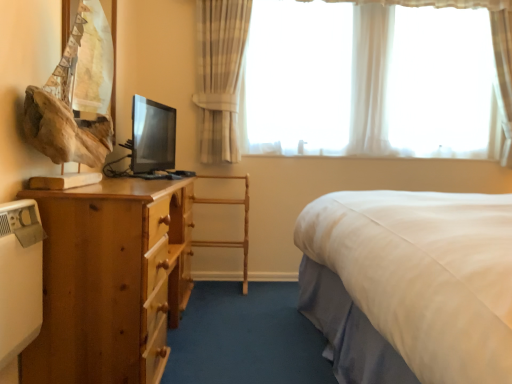
Question: Is the depth of white sheer curtains at upper center greater than that of wooden chair at center?

Choices:
 (A) yes
 (B) no

Answer: (A)

Question: Considering the relative positions of white sheer curtains at upper center and wooden chair at center in the image provided, is white sheer curtains at upper center in front of wooden chair at center?

Choices:
 (A) no
 (B) yes

Answer: (A)

Question: Is white sheer curtains at upper center wider than wooden chair at center?

Choices:
 (A) no
 (B) yes

Answer: (A)

Question: Is white sheer curtains at upper center next to wooden chair at center and touching it?

Choices:
 (A) yes
 (B) no

Answer: (B)

Question: Could you tell me if white sheer curtains at upper center is turned towards wooden chair at center?

Choices:
 (A) no
 (B) yes

Answer: (A)

Question: Considering the positions of point (x=166, y=281) and point (x=194, y=198), is point (x=166, y=281) closer or farther from the camera than point (x=194, y=198)?

Choices:
 (A) farther
 (B) closer

Answer: (B)

Question: Considering the positions of wooden drawer at lower left and wooden chair at center in the image, is wooden drawer at lower left bigger or smaller than wooden chair at center?

Choices:
 (A) big
 (B) small

Answer: (B)

Question: Is wooden drawer at lower left wider or thinner than wooden chair at center?

Choices:
 (A) wide
 (B) thin

Answer: (B)

Question: Would you say wooden drawer at lower left is to the left or to the right of wooden chair at center in the picture?

Choices:
 (A) right
 (B) left

Answer: (B)

Question: In terms of height, does wooden nightstand at left look taller or shorter compared to wooden chair at center?

Choices:
 (A) short
 (B) tall

Answer: (B)

Question: Does point (42, 248) appear closer or farther from the camera than point (227, 198)?

Choices:
 (A) farther
 (B) closer

Answer: (B)

Question: Considering the positions of wooden nightstand at left and wooden chair at center in the image, is wooden nightstand at left wider or thinner than wooden chair at center?

Choices:
 (A) thin
 (B) wide

Answer: (B)

Question: Based on their positions, is wooden nightstand at left located to the left or right of wooden chair at center?

Choices:
 (A) left
 (B) right

Answer: (A)

Question: Is point (245, 279) closer or farther from the camera than point (143, 364)?

Choices:
 (A) farther
 (B) closer

Answer: (A)

Question: Is wooden chair at center taller or shorter than wooden drawer at lower left?

Choices:
 (A) tall
 (B) short

Answer: (A)